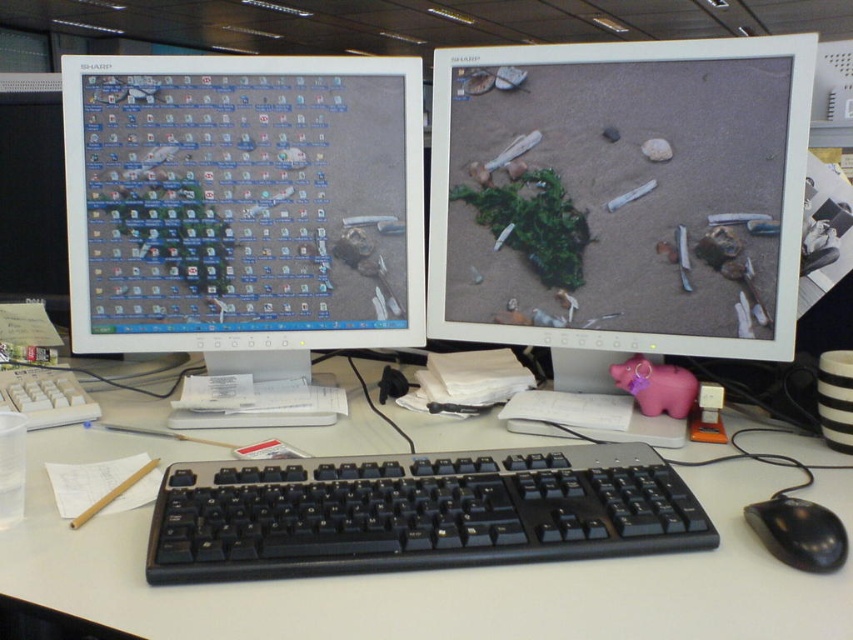
Question: Does matte plastic monitor at left appear on the right side of black plastic keyboard at center?

Choices:
 (A) no
 (B) yes

Answer: (A)

Question: Considering the real-world distances, which object is closest to the matte plastic monitor at left?

Choices:
 (A) black plastic mouse at lower right
 (B) white plastic keyboard at center

Answer: (B)

Question: Can you confirm if black plastic keyboard at center is positioned above black plastic mouse at lower right?

Choices:
 (A) yes
 (B) no

Answer: (A)

Question: Which of the following is the closest to the observer?

Choices:
 (A) matte plastic monitor at center
 (B) black plastic mouse at lower right
 (C) white plastic keyboard at center

Answer: (C)

Question: Is the position of matte plastic monitor at left more distant than that of white plastic keyboard at center?

Choices:
 (A) yes
 (B) no

Answer: (A)

Question: Which point is farther to the camera?

Choices:
 (A) (122, 177)
 (B) (751, 508)

Answer: (A)